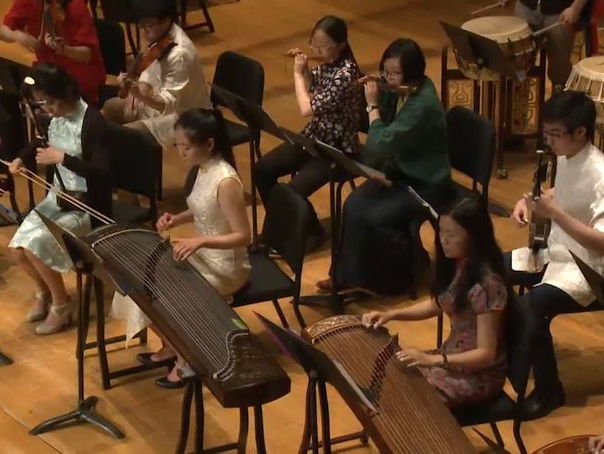
What are the coordinates of `floor` in the screenshot? It's located at (263, 36), (138, 405).